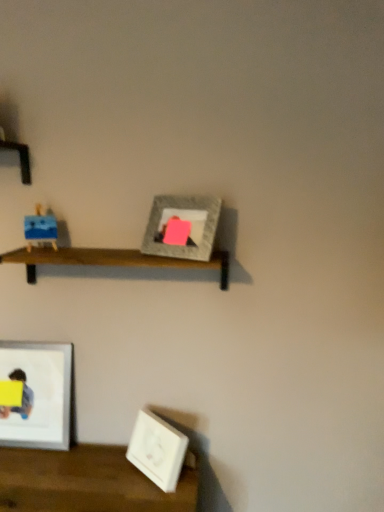
Image resolution: width=384 pixels, height=512 pixels. Find the location of `vacant space in front of matte blue toy at left`. vacant space in front of matte blue toy at left is located at coordinates (39, 254).